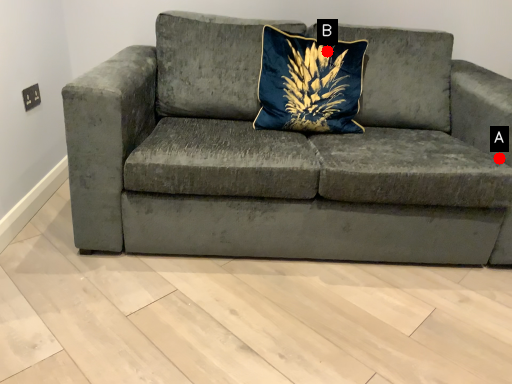
Question: Two points are circled on the image, labeled by A and B beside each circle. Among these points, which one is nearest to the camera?

Choices:
 (A) A is closer
 (B) B is closer

Answer: (A)